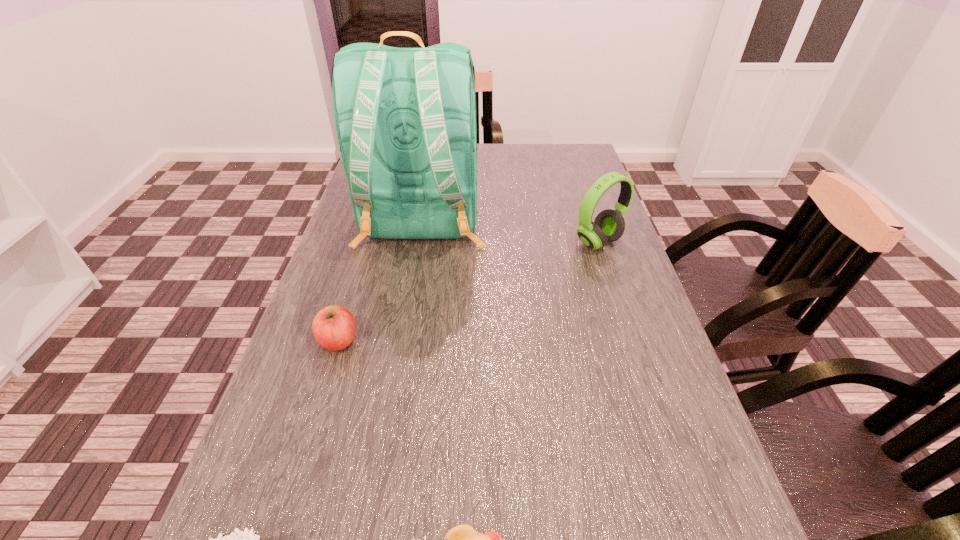
Identify the location of free space at the left edge of the desktop. The height and width of the screenshot is (540, 960). (372, 279).

In the image, there is a desktop. At what (x,y) coordinates should I click in order to perform the action: click on vacant space at the right edge. Please return your answer as a coordinate pair (x, y). Looking at the image, I should click on (578, 261).

Where is `vacant space at the far right corner of the desktop`? The image size is (960, 540). vacant space at the far right corner of the desktop is located at coordinates (555, 173).

Find the location of a particular element. This screenshot has height=540, width=960. vacant space that's between the apple and the tallest object is located at coordinates (380, 281).

At what (x,y) coordinates should I click in order to perform the action: click on free area in between the tallest object and the headset. Please return your answer as a coordinate pair (x, y). Looking at the image, I should click on (x=510, y=233).

Identify the location of vacant area that lies between the tallest object and the apple. Image resolution: width=960 pixels, height=540 pixels. (380, 281).

Locate an element on the screen. vacant area that lies between the rightmost object and the backpack is located at coordinates (510, 233).

Locate which object is the third closest to the apple. Please provide its 2D coordinates. Your answer should be formatted as a tuple, i.e. [(x, y)], where the tuple contains the x and y coordinates of a point satisfying the conditions above.

[(463, 539)]

Locate which object ranks third in proximity to the duckling. Please provide its 2D coordinates. Your answer should be formatted as a tuple, i.e. [(x, y)], where the tuple contains the x and y coordinates of a point satisfying the conditions above.

[(405, 118)]